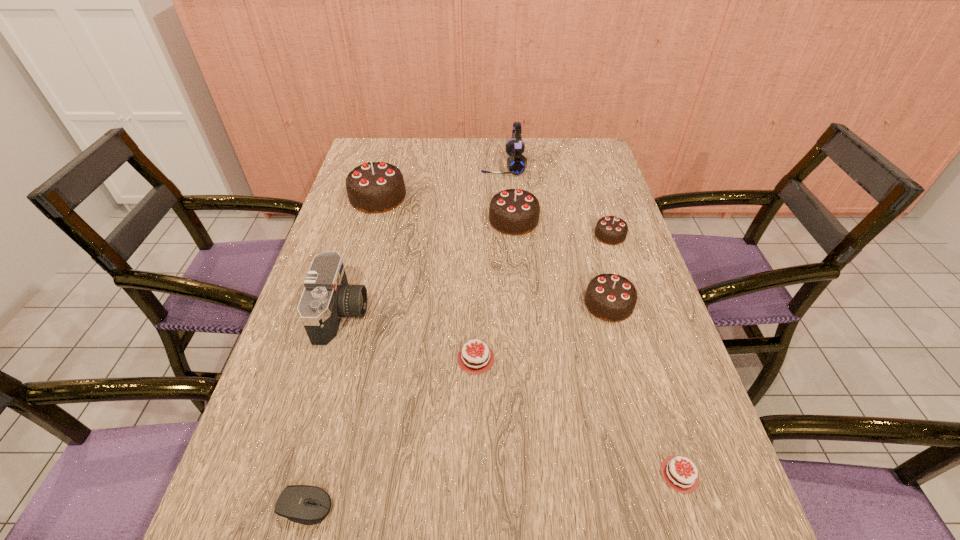
Where is `headset`? headset is located at coordinates (516, 163).

You are a GUI agent. You are given a task and a screenshot of the screen. Output one action in this format:
    pyautogui.click(x=<x>, y=<y>)
    Task: Click on the tallest chocolate cake
    Image resolution: width=960 pixels, height=540 pixels.
    Given the screenshot: What is the action you would take?
    pyautogui.click(x=375, y=187)

Where is `the leftmost chocolate cake`? the leftmost chocolate cake is located at coordinates (375, 187).

Where is `black camera`? The image size is (960, 540). black camera is located at coordinates (327, 297).

Locate an element on the screen. the second biggest chocolate chocolate cake is located at coordinates (512, 211).

Where is `the second chocolate chocolate cake from left to right`? This screenshot has height=540, width=960. the second chocolate chocolate cake from left to right is located at coordinates (512, 211).

The image size is (960, 540). What are the coordinates of `the third tallest chocolate cake` in the screenshot? It's located at (610, 297).

The image size is (960, 540). In order to click on the fifth tallest object in this screenshot , I will do `click(610, 297)`.

The height and width of the screenshot is (540, 960). I want to click on the fifth shortest object, so click(611, 230).

At what (x,y) coordinates should I click in order to perform the action: click on the fourth tallest chocolate cake. Please return your answer as a coordinate pair (x, y). This screenshot has width=960, height=540. Looking at the image, I should click on [x=611, y=230].